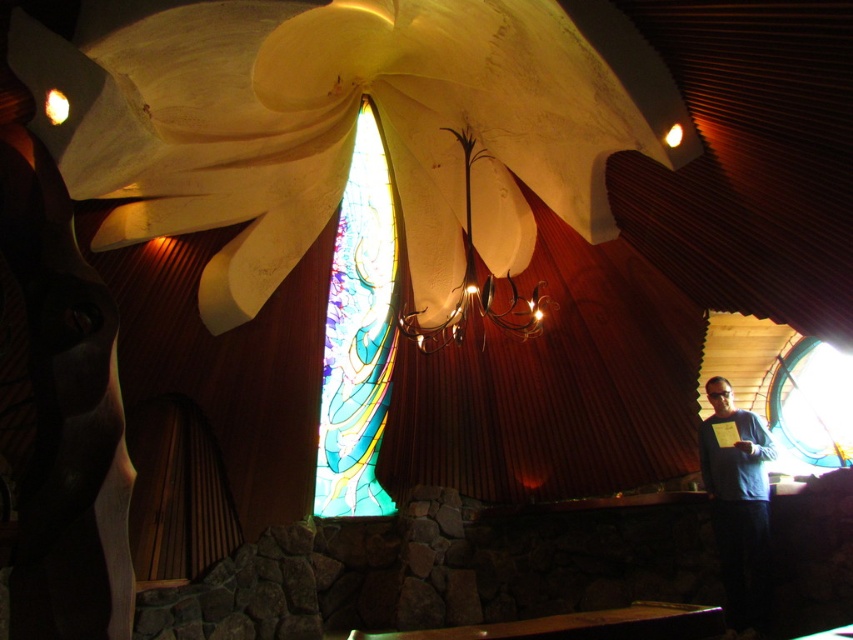
From the picture: You are an interior designer planning to install a new light fixture. You observe the white textured ceiling at center and the metallic gold chandelier at upper center. Which object occupies a greater area in the image?

The white textured ceiling at center has a larger size compared to the metallic gold chandelier at upper center, so it occupies a greater area in the image.

You are standing in the room and want to touch both the white textured ceiling at center and the metallic gold chandelier at upper center. Which object will require you to reach higher?

The metallic gold chandelier at upper center is further away from the viewer than the white textured ceiling at center, so you will need to reach higher to touch it.

You are an interior designer assessing the space. You notice the stained glass window at center and the blue sweater at center. Which object occupies a larger vertical space in the scene?

The stained glass window at center is much taller than the blue sweater at center, so it occupies a larger vertical space.